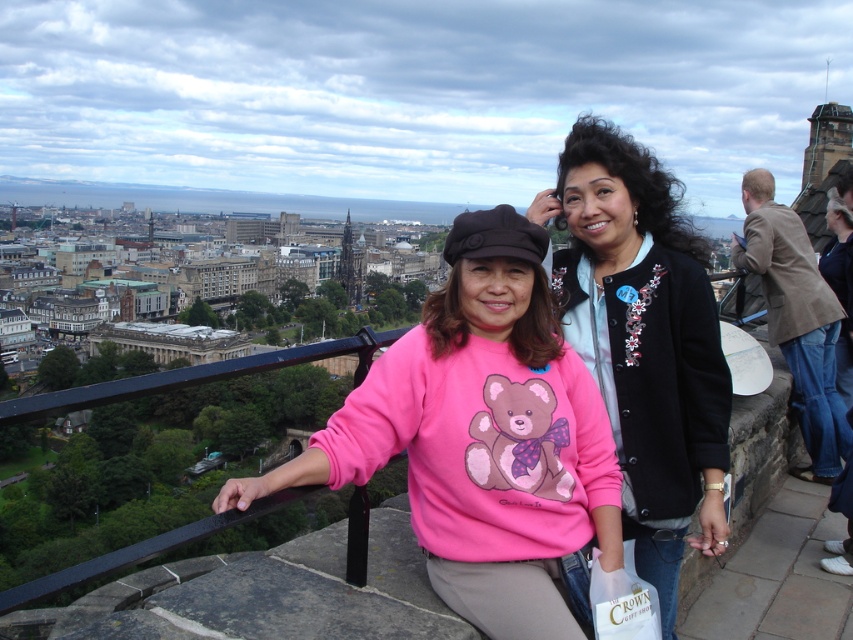
Question: Which point is closer to the camera?

Choices:
 (A) black matte jacket at center
 (B) pink fleece sweater at center

Answer: (B)

Question: Which object is farther from the camera taking this photo?

Choices:
 (A) brown leather jacket at upper right
 (B) pink fleece sweater at center
 (C) black matte jacket at center

Answer: (A)

Question: Does pink fleece sweater at center lie behind black matte jacket at center?

Choices:
 (A) yes
 (B) no

Answer: (B)

Question: Estimate the real-world distances between objects in this image. Which object is farther from the brown leather jacket at upper right?

Choices:
 (A) pink fleece sweater at center
 (B) black matte jacket at center

Answer: (A)

Question: Does black matte jacket at center have a greater width compared to brown leather jacket at upper right?

Choices:
 (A) yes
 (B) no

Answer: (A)

Question: Is pink fleece sweater at center smaller than black matte jacket at center?

Choices:
 (A) yes
 (B) no

Answer: (B)